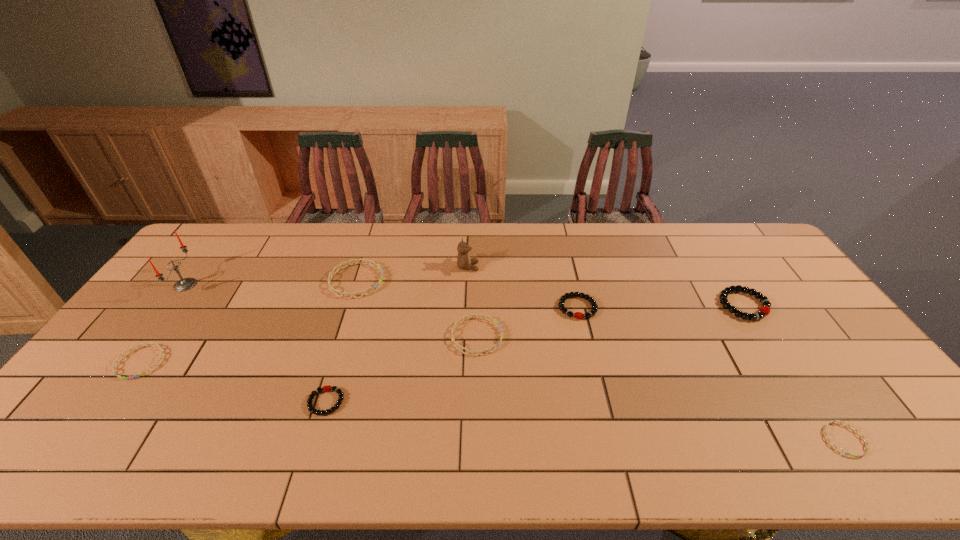
You are a GUI agent. You are given a task and a screenshot of the screen. Output one action in this format:
    pyautogui.click(x=<x>, y=<y>)
    Task: Click on the seventh object from left to right
    The width and height of the screenshot is (960, 540).
    Given the screenshot: What is the action you would take?
    pyautogui.click(x=578, y=315)

Where is `the leftmost blue bracelet`? Image resolution: width=960 pixels, height=540 pixels. the leftmost blue bracelet is located at coordinates (116, 362).

Find the location of a particular element. the leftmost bracelet is located at coordinates (116, 362).

Locate an element on the screen. This screenshot has height=540, width=960. the second nearest bracelet is located at coordinates (324, 388).

Where is `the leftmost black bracelet`? the leftmost black bracelet is located at coordinates [x=324, y=388].

Find the location of a particular element. Image resolution: width=960 pixels, height=540 pixels. the smallest blue bracelet is located at coordinates (825, 433).

Locate an element on the screen. the nearest bracelet is located at coordinates (825, 433).

At what (x,y) coordinates should I click in order to perform the action: click on free space located on the front-facing side of the tallest object. Please return your answer as a coordinate pair (x, y). The width and height of the screenshot is (960, 540). Looking at the image, I should click on (229, 285).

The width and height of the screenshot is (960, 540). What are the coordinates of `free space located on the front-facing side of the second tallest object` in the screenshot? It's located at (514, 267).

Find the location of a particular element. vacant space situated 0.370m on the surface of the biggest blue bracelet showing star-shaped elements is located at coordinates (496, 281).